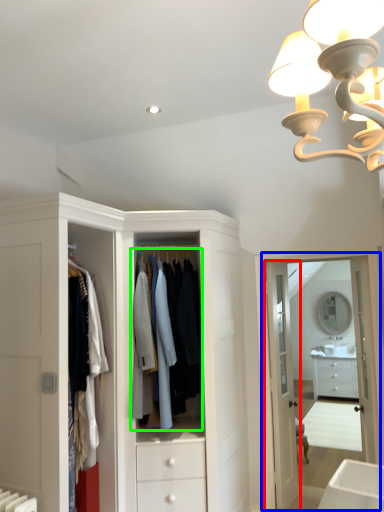
Question: Which object is the closest to the door (highlighted by a red box)? Choose among these: medicine cabinet (highlighted by a blue box) or clothing (highlighted by a green box).

Choices:
 (A) medicine cabinet
 (B) clothing

Answer: (A)